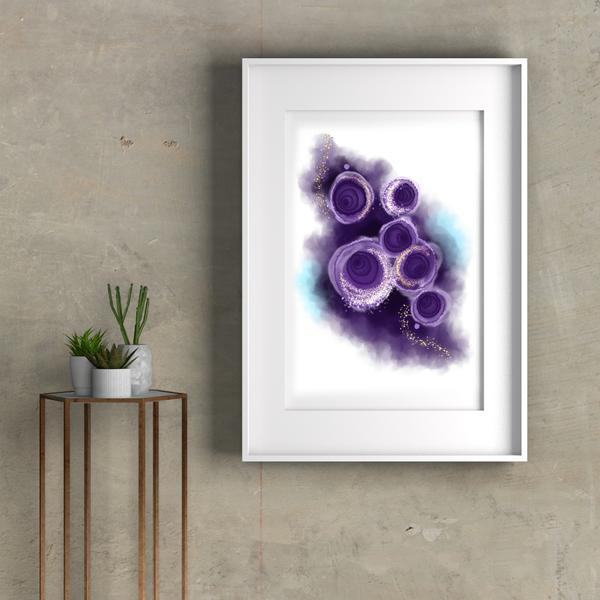
The height and width of the screenshot is (600, 600). In order to click on gray pot in this screenshot , I will do `click(78, 366)`, `click(153, 365)`.